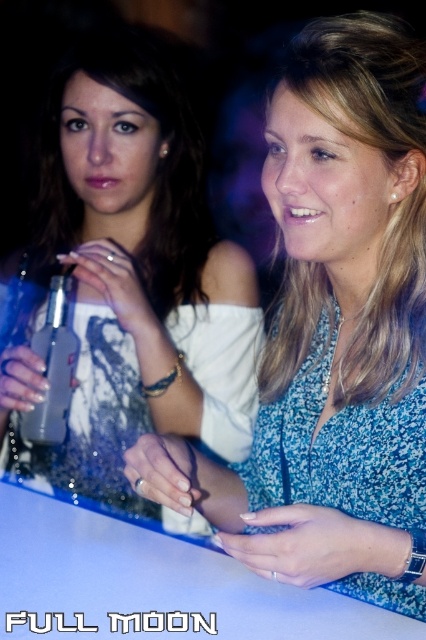
You are at a party and want to take a photo of the matte white dress at center. Your camera can focus on objects up to 25 inches away. Will the dress be in focus?

The matte white dress at center is 26.07 inches away from the viewer, which is beyond the camera focus range of 25 inches. The dress will not be in focus.

You are a photographer at the event and want to capture a photo that includes both the matte white dress at center and the matte black dress at upper left. Which dress should you position closer to the camera to ensure both are fully visible in the frame?

The matte white dress at center is shorter than the matte black dress at upper left, so positioning the matte white dress at center closer to the camera will ensure both dresses are fully visible in the frame.

You are at a party and see a person wearing a matte black dress at upper left and a clear glass bottle at center. Which object is closer to you?

The matte black dress at upper left is closer to you because it is in front of the clear glass bottle at center.